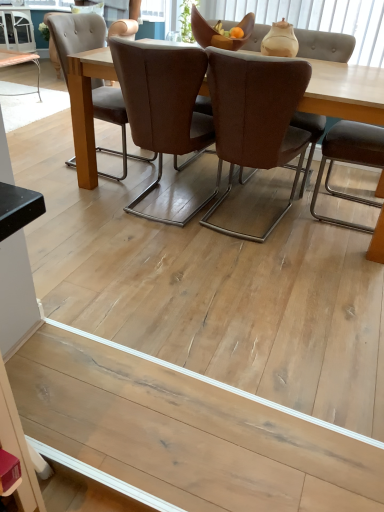
Question: From a real-world perspective, is natural wood floor at lower center physically above white glossy cabinet at upper left?

Choices:
 (A) yes
 (B) no

Answer: (B)

Question: Can you confirm if natural wood floor at lower center is thinner than white glossy cabinet at upper left?

Choices:
 (A) no
 (B) yes

Answer: (B)

Question: Is natural wood floor at lower center further to camera compared to white glossy cabinet at upper left?

Choices:
 (A) yes
 (B) no

Answer: (B)

Question: Would you consider natural wood floor at lower center to be distant from white glossy cabinet at upper left?

Choices:
 (A) no
 (B) yes

Answer: (B)

Question: Considering the relative positions of natural wood floor at lower center and white glossy cabinet at upper left in the image provided, is natural wood floor at lower center in front of white glossy cabinet at upper left?

Choices:
 (A) yes
 (B) no

Answer: (A)

Question: Does point (188, 58) appear closer or farther from the camera than point (240, 234)?

Choices:
 (A) farther
 (B) closer

Answer: (B)

Question: Based on their sizes in the image, would you say brown leather chair at center, positioned as the 3th chair in right-to-left order, is bigger or smaller than brown fabric chair at center, which appears as the second chair when viewed from the left?

Choices:
 (A) small
 (B) big

Answer: (B)

Question: Choose the correct answer: Is brown leather chair at center, which ranks as the first chair in left-to-right order, inside brown fabric chair at center, which ranks as the 2th chair in right-to-left order, or outside it?

Choices:
 (A) inside
 (B) outside

Answer: (B)

Question: Would you say brown leather chair at center, positioned as the 3th chair in right-to-left order, is to the left or to the right of brown fabric chair at center, which ranks as the 2th chair in right-to-left order, in the picture?

Choices:
 (A) left
 (B) right

Answer: (A)

Question: Would you say brown leather chair at right, marked as the third chair in a left-to-right arrangement, is inside or outside white glossy cabinet at upper left?

Choices:
 (A) outside
 (B) inside

Answer: (A)

Question: Considering the positions of brown leather chair at right, marked as the third chair in a left-to-right arrangement, and white glossy cabinet at upper left in the image, is brown leather chair at right, marked as the third chair in a left-to-right arrangement, bigger or smaller than white glossy cabinet at upper left?

Choices:
 (A) big
 (B) small

Answer: (B)

Question: In the image, is brown leather chair at right, which ranks as the first chair in right-to-left order, positioned in front of or behind white glossy cabinet at upper left?

Choices:
 (A) front
 (B) behind

Answer: (A)

Question: Is point (331, 143) closer or farther from the camera than point (21, 36)?

Choices:
 (A) farther
 (B) closer

Answer: (B)

Question: From the image's perspective, is matte beige vase at upper center positioned above or below natural wood floor at lower center?

Choices:
 (A) below
 (B) above

Answer: (B)

Question: Considering their positions, is matte beige vase at upper center located in front of or behind natural wood floor at lower center?

Choices:
 (A) behind
 (B) front

Answer: (A)